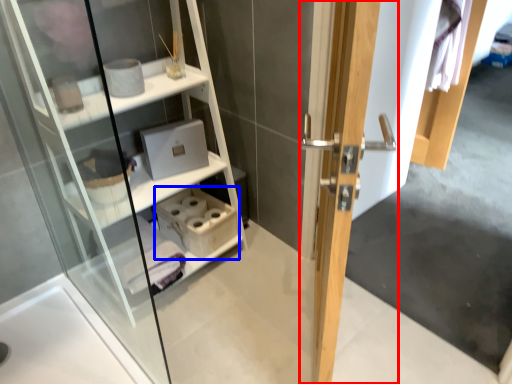
Question: Which object appears closest to the camera in this image, door (highlighted by a red box) or cabinet (highlighted by a blue box)?

Choices:
 (A) door
 (B) cabinet

Answer: (A)